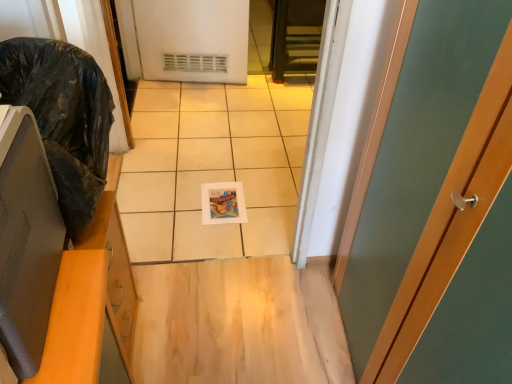
Question: In the image, is black plastic bag at left on the left side or the right side of matte black monitor at left?

Choices:
 (A) left
 (B) right

Answer: (A)

Question: Is point (44, 56) closer or farther from the camera than point (48, 317)?

Choices:
 (A) farther
 (B) closer

Answer: (A)

Question: From a real-world perspective, relative to matte black monitor at left, is black plastic bag at left vertically above or below?

Choices:
 (A) below
 (B) above

Answer: (A)

Question: In terms of size, does matte black monitor at left appear bigger or smaller than black plastic bag at left?

Choices:
 (A) big
 (B) small

Answer: (B)

Question: Looking at their shapes, would you say matte black monitor at left is wider or thinner than black plastic bag at left?

Choices:
 (A) wide
 (B) thin

Answer: (B)

Question: Does point (31, 213) appear closer or farther from the camera than point (64, 165)?

Choices:
 (A) farther
 (B) closer

Answer: (B)

Question: Visually, is matte black monitor at left positioned to the left or to the right of black plastic bag at left?

Choices:
 (A) right
 (B) left

Answer: (A)